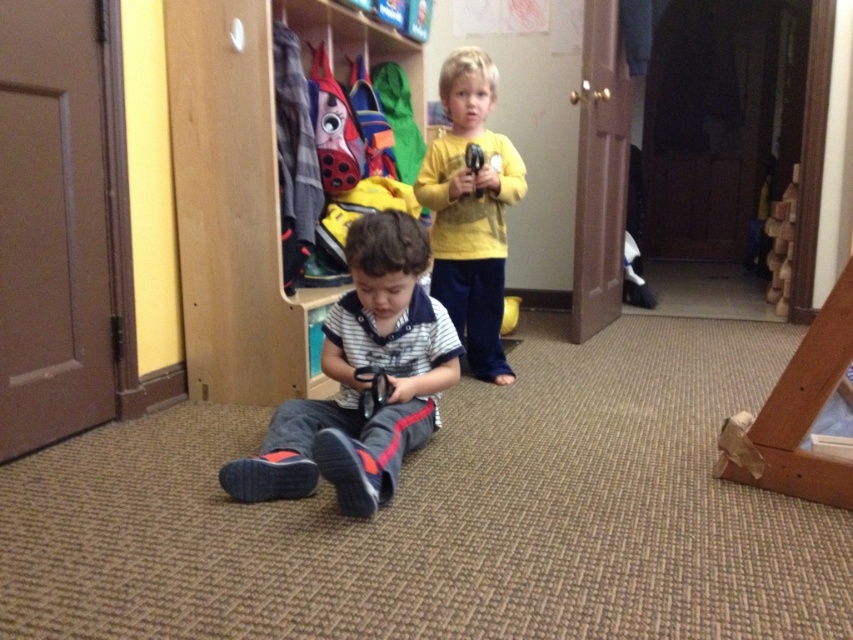
Based on the photo, you are a parent in the hallway and want to place a new decoration on the wooden at center. However, you also have a striped cotton shirt at center that needs to be hung up. Considering their sizes, which object should you place first to ensure both fit in the space?

The wooden at center is taller than the striped cotton shirt at center. Therefore, you should place the wooden at center first in the available space to accommodate its greater height before hanging the striped cotton shirt at center.

Consider the image. You are a parent trying to locate your child. You see the wooden at center and the striped cotton shirt at center. Which object is higher up?

The wooden at center is above the striped cotton shirt at center, so the wooden at center is higher up.